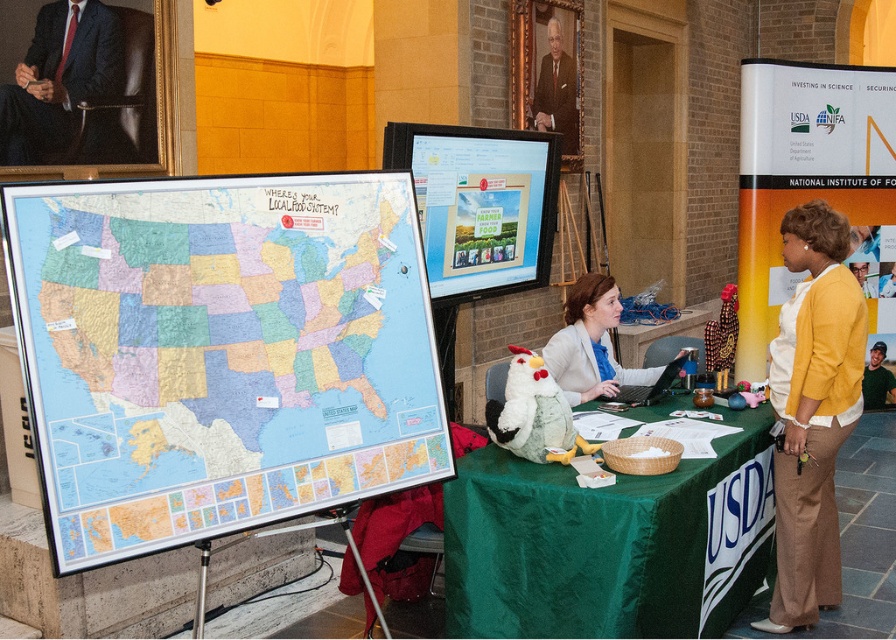
Question: Does light beige blazer at center have a larger size compared to formal suit at upper center?

Choices:
 (A) no
 (B) yes

Answer: (B)

Question: Which of the following is the closest to the observer?

Choices:
 (A) (35, 56)
 (B) (147, 378)
 (C) (533, 108)
 (D) (608, 365)

Answer: (B)

Question: Does green satin tablecloth at center appear under formal suit at upper center?

Choices:
 (A) yes
 (B) no

Answer: (A)

Question: Which point is closer to the camera taking this photo?

Choices:
 (A) (851, 388)
 (B) (62, 70)
 (C) (711, 525)

Answer: (C)

Question: Which object appears closest to the camera in this image?

Choices:
 (A) formal suit at upper center
 (B) green satin tablecloth at center

Answer: (B)

Question: Does matte paper map at left appear on the left side of formal suit at upper center?

Choices:
 (A) yes
 (B) no

Answer: (A)